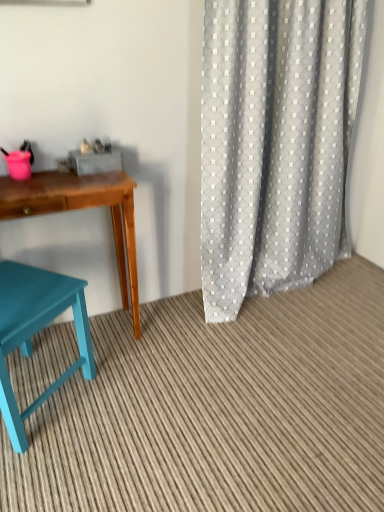
This screenshot has height=512, width=384. I want to click on free area in between teal wood desk at left and teal painted wood chair at lower left, so click(109, 368).